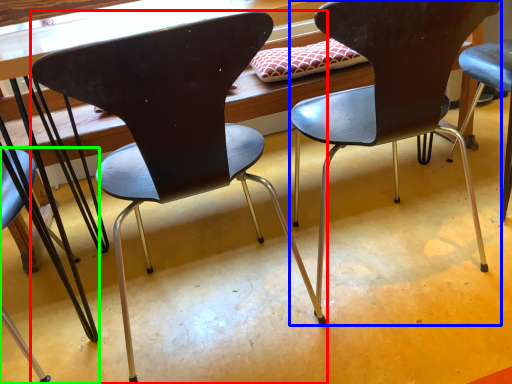
Question: Which object is positioned farthest from chair (highlighted by a red box)? Select from chair (highlighted by a blue box) and chair (highlighted by a green box).

Choices:
 (A) chair
 (B) chair

Answer: (B)